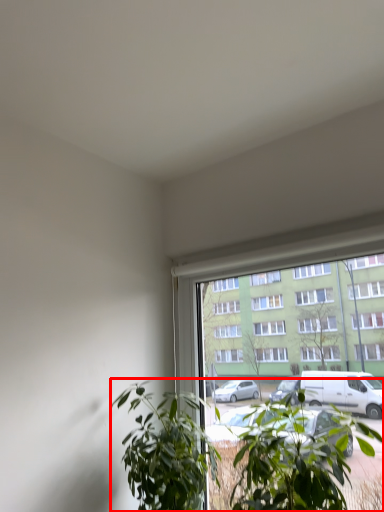
Question: From the image's perspective, where is houseplant (annotated by the red box) located in relation to houseplant in the image?

Choices:
 (A) below
 (B) above

Answer: (B)